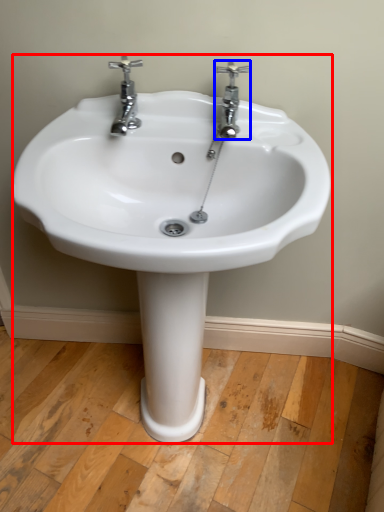
Question: Which point is further to the camera, sink (highlighted by a red box) or tap (highlighted by a blue box)?

Choices:
 (A) sink
 (B) tap

Answer: (B)